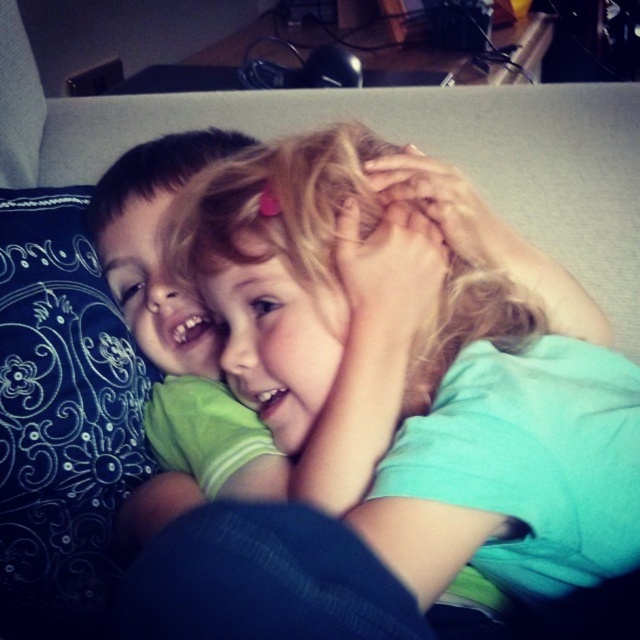
Question: Which is nearer to the dark blue fabric at center?

Choices:
 (A) blonde hair at center
 (B) blue embroidered pillow at left
 (C) matte green shirt at center

Answer: (A)

Question: Does blue embroidered pillow at left lie behind matte green shirt at center?

Choices:
 (A) yes
 (B) no

Answer: (B)

Question: Does blue embroidered pillow at left appear over matte green shirt at center?

Choices:
 (A) no
 (B) yes

Answer: (A)

Question: Can you confirm if dark blue fabric at center is bigger than matte green shirt at center?

Choices:
 (A) no
 (B) yes

Answer: (A)

Question: Estimate the real-world distances between objects in this image. Which object is farther from the matte green shirt at center?

Choices:
 (A) dark blue fabric at center
 (B) blue embroidered pillow at left

Answer: (A)

Question: Which of the following is the closest to the observer?

Choices:
 (A) matte green shirt at center
 (B) dark blue fabric at center

Answer: (B)